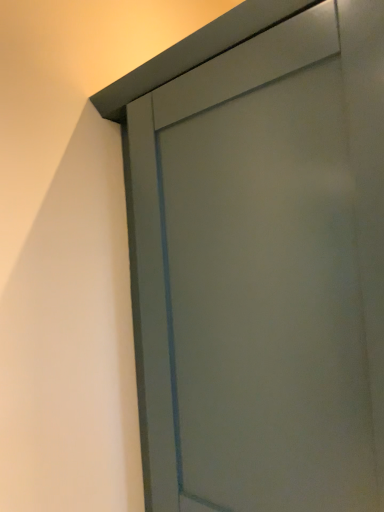
Image resolution: width=384 pixels, height=512 pixels. What do you see at coordinates (263, 271) in the screenshot? I see `matte gray door at upper center` at bounding box center [263, 271].

Locate an element on the screen. This screenshot has height=512, width=384. matte gray door at upper center is located at coordinates (263, 271).

Where is `matte gray door at upper center`? This screenshot has width=384, height=512. matte gray door at upper center is located at coordinates pos(263,271).